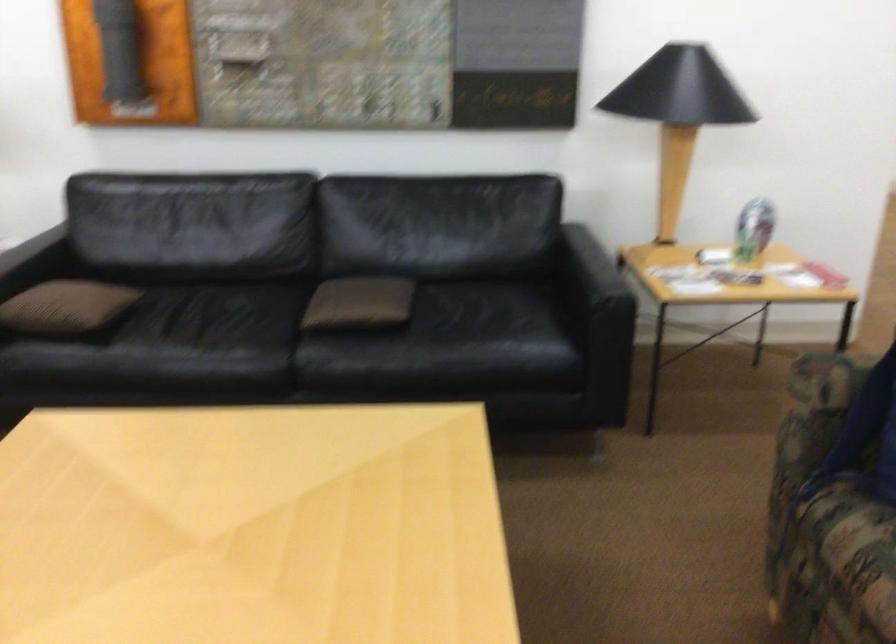
The image size is (896, 644). What are the coordinates of `black sofa armrest` in the screenshot? It's located at (599, 306).